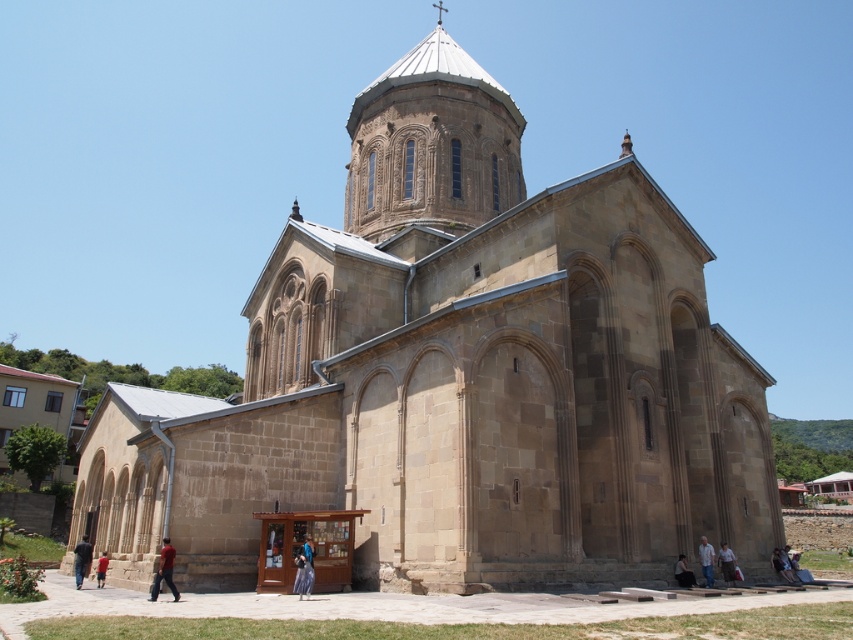
You are standing in front of the historic stone church and notice two items on the ground. You see the red fabric pants at lower left and the light brown leather jacket at lower right. Which item is closer to you?

The red fabric pants at lower left is closer to you since it is in front of the light brown leather jacket at lower right.

You are standing in front of the historic stone church and see the dark gray stone person at lower center and the light blue fabric shirt at lower right. Which object is closer to you?

The light blue fabric shirt at lower right is closer to you because the dark gray stone person at lower center is behind it.

You are a photographer standing in front of the historic stone church. You want to take a photo that includes both the light blue fabric shirt at lower right and the light brown leather jacket at lower right. What is the minimum distance you need to move backward to ensure both items are fully visible in your frame?

The light blue fabric shirt at lower right is 1.69 meters from the light brown leather jacket at lower right. To capture both in the frame, you need to move back at least 1.69 meters to ensure they are fully visible.